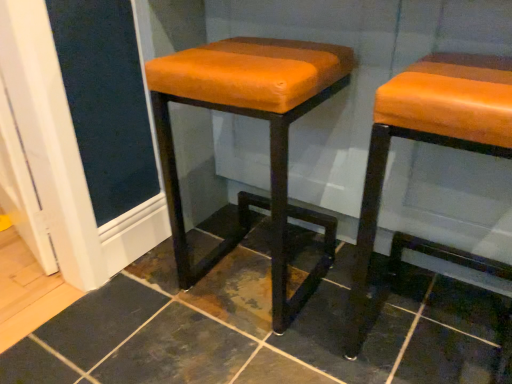
Question: Can you confirm if orange leather stool at right, which is the first stool from right to left, is positioned to the left of orange leather stool at center, which appears as the 2th stool when viewed from the right?

Choices:
 (A) yes
 (B) no

Answer: (B)

Question: Is orange leather stool at right, which is the first stool from right to left, turned away from orange leather stool at center, which ranks as the first stool in left-to-right order?

Choices:
 (A) no
 (B) yes

Answer: (A)

Question: Can you see orange leather stool at right, the second stool viewed from the left, touching orange leather stool at center, which appears as the 2th stool when viewed from the right?

Choices:
 (A) no
 (B) yes

Answer: (A)

Question: Is orange leather stool at right, the second stool viewed from the left, positioned before orange leather stool at center, which appears as the 2th stool when viewed from the right?

Choices:
 (A) no
 (B) yes

Answer: (B)

Question: Can you confirm if orange leather stool at right, which is the first stool from right to left, is bigger than orange leather stool at center, which ranks as the first stool in left-to-right order?

Choices:
 (A) yes
 (B) no

Answer: (B)

Question: Considering the relative sizes of orange leather stool at right, which is the first stool from right to left, and orange leather stool at center, which appears as the 2th stool when viewed from the right, in the image provided, is orange leather stool at right, which is the first stool from right to left, wider than orange leather stool at center, which appears as the 2th stool when viewed from the right,?

Choices:
 (A) yes
 (B) no

Answer: (A)

Question: Considering the relative positions of orange leather stool at center, which appears as the 2th stool when viewed from the right, and orange leather stool at right, the second stool viewed from the left, in the image provided, is orange leather stool at center, which appears as the 2th stool when viewed from the right, to the left of orange leather stool at right, the second stool viewed from the left, from the viewer's perspective?

Choices:
 (A) no
 (B) yes

Answer: (B)

Question: Does orange leather stool at center, which ranks as the first stool in left-to-right order, touch orange leather stool at right, the second stool viewed from the left?

Choices:
 (A) no
 (B) yes

Answer: (A)

Question: From a real-world perspective, is orange leather stool at center, which appears as the 2th stool when viewed from the right, below orange leather stool at right, the second stool viewed from the left?

Choices:
 (A) yes
 (B) no

Answer: (A)

Question: From a real-world perspective, is orange leather stool at center, which appears as the 2th stool when viewed from the right, physically above orange leather stool at right, the second stool viewed from the left?

Choices:
 (A) yes
 (B) no

Answer: (B)

Question: Is orange leather stool at center, which appears as the 2th stool when viewed from the right, turned away from orange leather stool at right, which is the first stool from right to left?

Choices:
 (A) no
 (B) yes

Answer: (A)

Question: Is orange leather stool at center, which appears as the 2th stool when viewed from the right, outside of orange leather stool at right, which is the first stool from right to left?

Choices:
 (A) yes
 (B) no

Answer: (A)

Question: Would you say orange leather stool at right, which is the first stool from right to left, is inside or outside orange leather stool at center, which appears as the 2th stool when viewed from the right?

Choices:
 (A) inside
 (B) outside

Answer: (B)